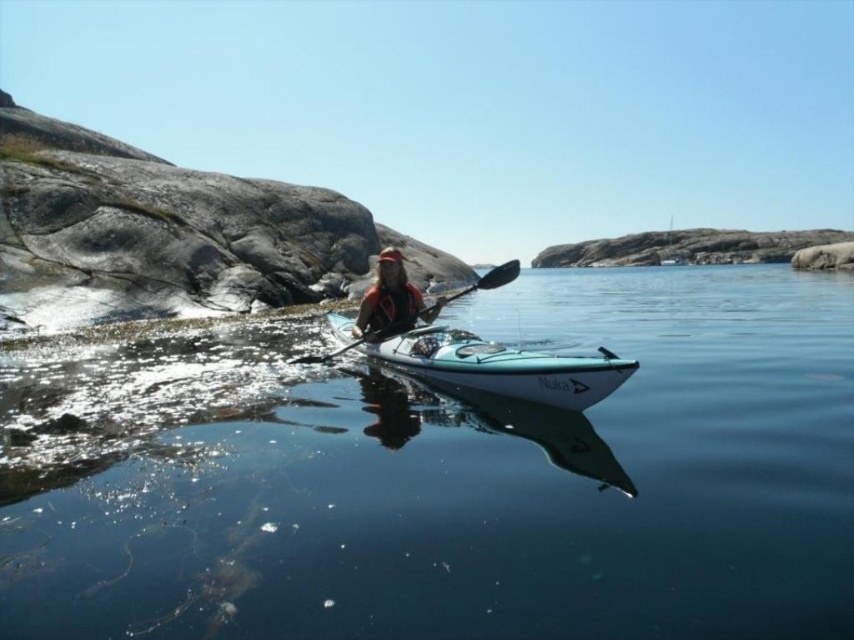
Question: Which of these objects is positioned farthest from the teal glossy canoe at center?

Choices:
 (A) clear blue water at center
 (B) black plastic paddle at center

Answer: (A)

Question: Which point is closer to the camera?

Choices:
 (A) teal glossy canoe at center
 (B) clear blue water at center
 (C) matte orange life vest at center
 (D) black plastic paddle at center

Answer: (B)

Question: Which object is the farthest from the teal glossy canoe at center?

Choices:
 (A) black plastic paddle at center
 (B) clear blue water at center
 (C) matte orange life vest at center

Answer: (B)

Question: Can you confirm if clear blue water at center is bigger than matte orange life vest at center?

Choices:
 (A) yes
 (B) no

Answer: (A)

Question: Can you confirm if teal glossy canoe at center is thinner than black plastic paddle at center?

Choices:
 (A) no
 (B) yes

Answer: (B)

Question: Does clear blue water at center have a larger size compared to black plastic paddle at center?

Choices:
 (A) yes
 (B) no

Answer: (A)